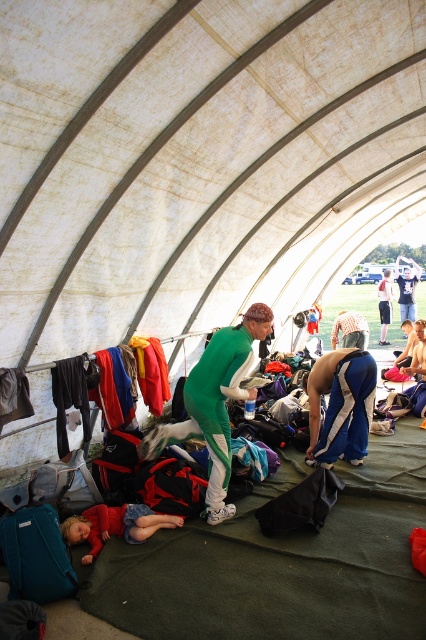
What do you see at coordinates (350, 330) in the screenshot? The image size is (426, 640). I see `green fabric person at center` at bounding box center [350, 330].

This screenshot has height=640, width=426. Find the location of `green fabric person at center`. green fabric person at center is located at coordinates (350, 330).

Who is higher up, green spandex suit at center or shiny metallic helmet at center?

shiny metallic helmet at center is above.

Between green spandex suit at center and shiny metallic helmet at center, which one has more height?

green spandex suit at center is taller.

Describe the element at coordinates (215, 403) in the screenshot. I see `green spandex suit at center` at that location.

Where is `green spandex suit at center`? green spandex suit at center is located at coordinates (215, 403).

Who is higher up, matte red dress at lower left or shiny metallic helmet at center?

shiny metallic helmet at center is higher up.

Looking at this image, which is more to the left, matte red dress at lower left or shiny metallic helmet at center?

From the viewer's perspective, matte red dress at lower left appears more on the left side.

What do you see at coordinates (115, 525) in the screenshot?
I see `matte red dress at lower left` at bounding box center [115, 525].

Locate an element on the screen. The image size is (426, 640). matte red dress at lower left is located at coordinates coord(115,525).